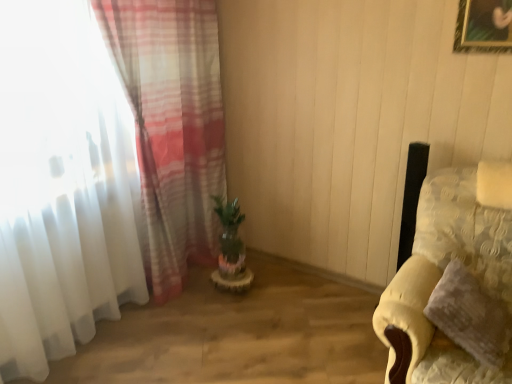
Question: Is yellow fabric couch at right completely or partially outside of fluffy yellow pillow at right?

Choices:
 (A) yes
 (B) no

Answer: (A)

Question: From the image's perspective, is yellow fabric couch at right on top of fluffy yellow pillow at right?

Choices:
 (A) no
 (B) yes

Answer: (B)

Question: Can you confirm if yellow fabric couch at right is taller than fluffy yellow pillow at right?

Choices:
 (A) no
 (B) yes

Answer: (B)

Question: Is yellow fabric couch at right in contact with fluffy yellow pillow at right?

Choices:
 (A) yes
 (B) no

Answer: (B)

Question: Does yellow fabric couch at right appear on the left side of fluffy yellow pillow at right?

Choices:
 (A) no
 (B) yes

Answer: (A)

Question: Considering the relative sizes of yellow fabric couch at right and fluffy yellow pillow at right in the image provided, is yellow fabric couch at right wider than fluffy yellow pillow at right?

Choices:
 (A) no
 (B) yes

Answer: (B)

Question: Does yellow fabric couch at right touch translucent fabric curtain at left?

Choices:
 (A) yes
 (B) no

Answer: (B)

Question: Is yellow fabric couch at right not within translucent fabric curtain at left?

Choices:
 (A) yes
 (B) no

Answer: (A)

Question: Considering the relative sizes of yellow fabric couch at right and translucent fabric curtain at left in the image provided, is yellow fabric couch at right taller than translucent fabric curtain at left?

Choices:
 (A) yes
 (B) no

Answer: (B)

Question: From the image's perspective, is yellow fabric couch at right below translucent fabric curtain at left?

Choices:
 (A) no
 (B) yes

Answer: (B)

Question: Does yellow fabric couch at right have a lesser height compared to translucent fabric curtain at left?

Choices:
 (A) no
 (B) yes

Answer: (B)

Question: Does yellow fabric couch at right appear on the right side of translucent fabric curtain at left?

Choices:
 (A) yes
 (B) no

Answer: (A)

Question: Does green matte plant at center have a larger size compared to yellow fabric couch at right?

Choices:
 (A) yes
 (B) no

Answer: (B)